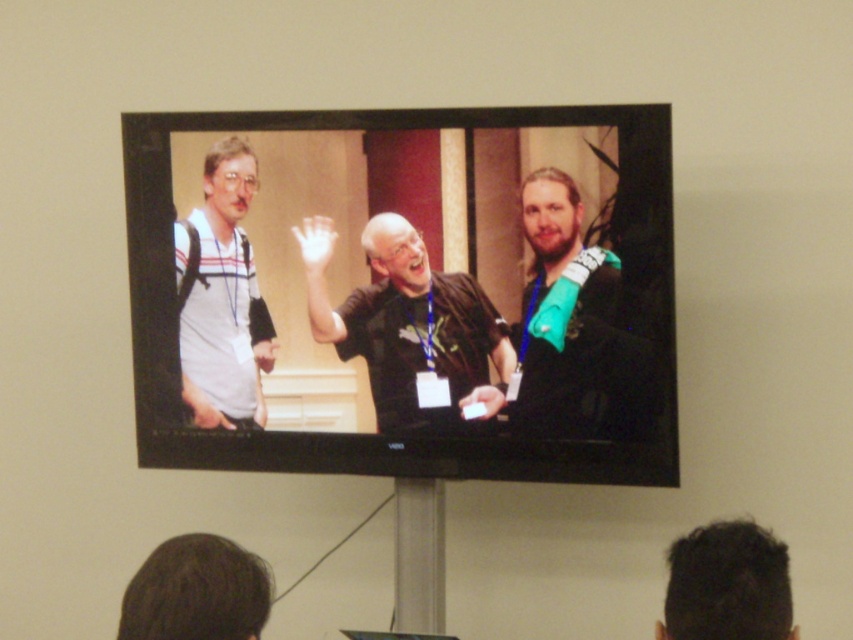
Can you confirm if black matte shirt at center is bigger than teal fabric arm at right?

Indeed, black matte shirt at center has a larger size compared to teal fabric arm at right.

Who is taller, black matte shirt at center or teal fabric arm at right?

With more height is teal fabric arm at right.

Is point (321, 285) positioned in front of point (544, 428)?

No.

You are a GUI agent. You are given a task and a screenshot of the screen. Output one action in this format:
    pyautogui.click(x=<x>, y=<y>)
    Task: Click on the black matte shirt at center
    The image size is (853, 640).
    Given the screenshot: What is the action you would take?
    pyautogui.click(x=407, y=323)

Does point (550, 392) lie in front of point (231, 188)?

Yes, point (550, 392) is closer to viewer.

Is teal fabric arm at right taller than white striped shirt at left?

Incorrect, teal fabric arm at right's height is not larger of white striped shirt at left's.

Is point (541, 381) less distant than point (210, 234)?

Yes, point (541, 381) is closer to viewer.

The image size is (853, 640). In order to click on teal fabric arm at right in this screenshot , I will do `click(569, 323)`.

Can you confirm if matte black tv at center is positioned to the right of teal fabric arm at right?

No, matte black tv at center is not to the right of teal fabric arm at right.

Is matte black tv at center positioned in front of teal fabric arm at right?

Yes, matte black tv at center is in front of teal fabric arm at right.

Describe the element at coordinates (404, 292) in the screenshot. This screenshot has height=640, width=853. I see `matte black tv at center` at that location.

You are a GUI agent. You are given a task and a screenshot of the screen. Output one action in this format:
    pyautogui.click(x=<x>, y=<y>)
    Task: Click on the matte black tv at center
    This screenshot has width=853, height=640.
    Given the screenshot: What is the action you would take?
    pyautogui.click(x=404, y=292)